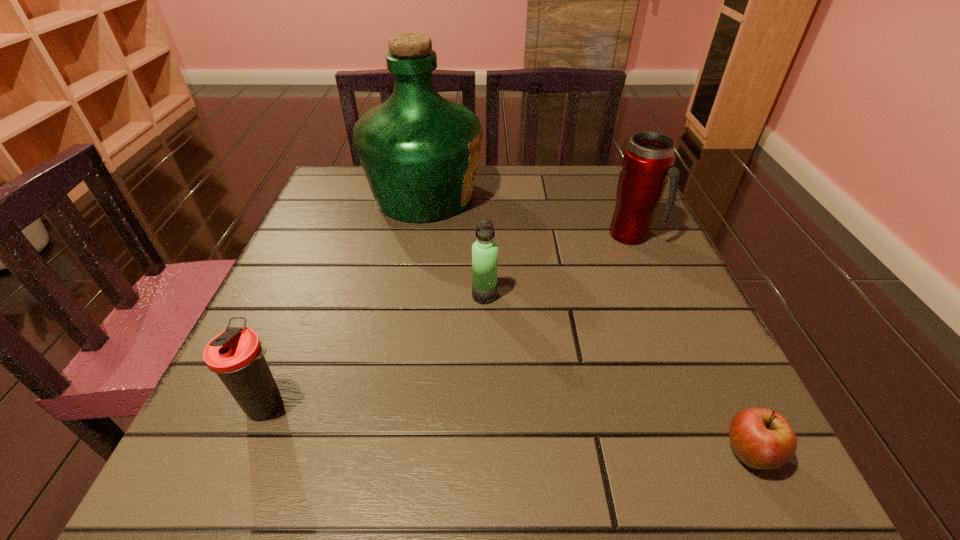
The height and width of the screenshot is (540, 960). I want to click on vacant space located 0.290m on the left of the second thermos bottle from left to right, so click(318, 295).

I want to click on vacant area situated 0.200m on the right of the leftmost thermos bottle, so click(x=427, y=405).

Where is `free region located 0.320m on the back of the nearest object`? The image size is (960, 540). free region located 0.320m on the back of the nearest object is located at coordinates [666, 278].

I want to click on object present at the far edge, so click(419, 151).

In order to click on object that is at the near edge in this screenshot , I will do point(761,438).

Identify the location of liquor present at the left edge. This screenshot has height=540, width=960. (419, 151).

Where is `thermos bottle at the left edge`? thermos bottle at the left edge is located at coordinates (236, 355).

Locate an element on the screen. Image resolution: width=960 pixels, height=540 pixels. thermos bottle at the right edge is located at coordinates (647, 162).

At what (x,y) coordinates should I click in order to perform the action: click on apple situated at the right edge. Please return your answer as a coordinate pair (x, y). The height and width of the screenshot is (540, 960). Looking at the image, I should click on (761, 438).

Find the location of a particular element. Image resolution: width=960 pixels, height=540 pixels. object that is at the far left corner is located at coordinates (419, 151).